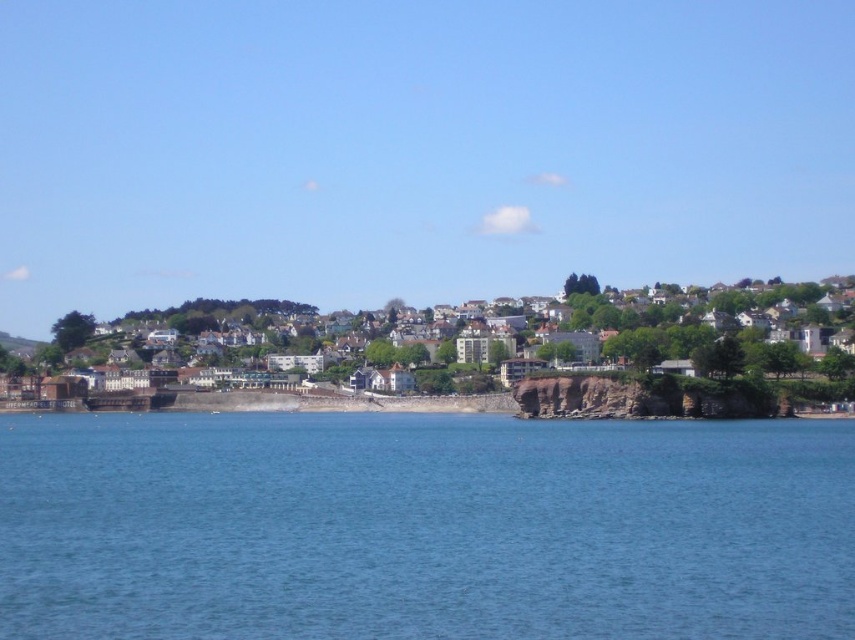
Is blue water at lower center shorter than white textured houses at center?

Indeed, blue water at lower center has a lesser height compared to white textured houses at center.

Which is in front, point (378, 472) or point (369, 349)?

Point (378, 472)

Does point (198, 632) lie behind point (387, 353)?

No.

Find the location of a particular element. This screenshot has height=640, width=855. blue water at lower center is located at coordinates (423, 528).